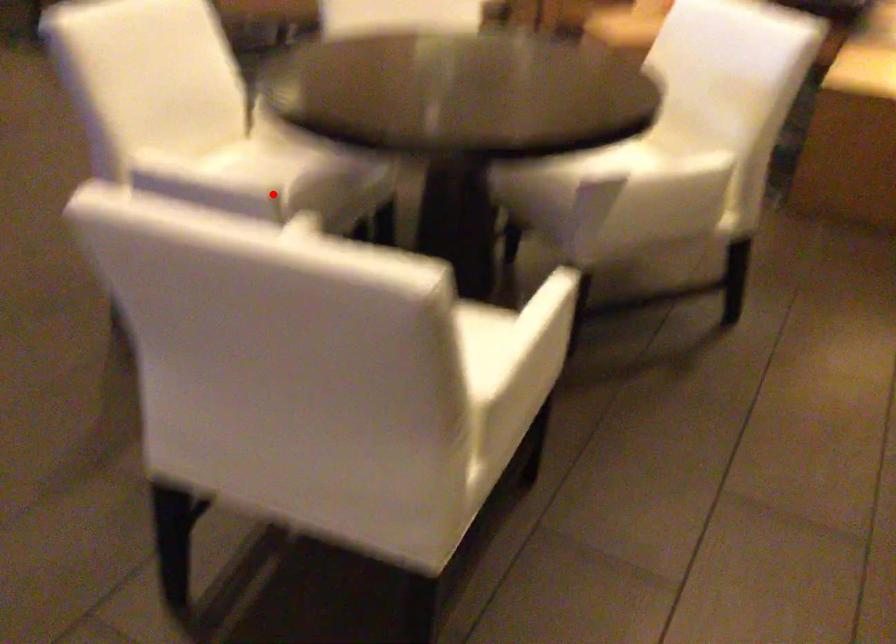
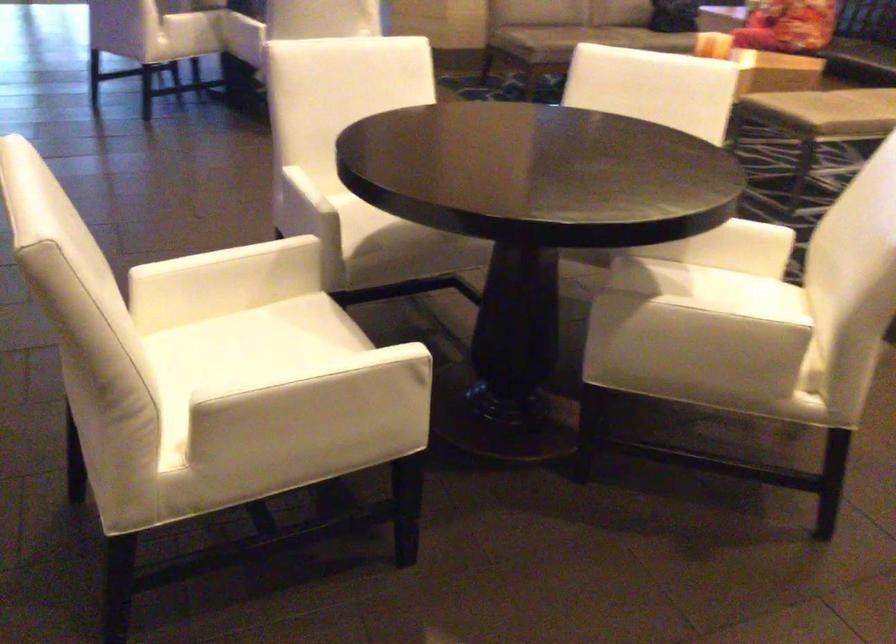
Locate, in the second image, the point that corresponds to the highlighted location in the first image.

(372, 223)